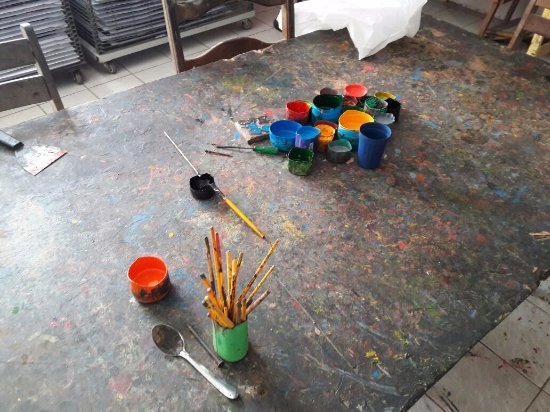
Identify the location of paintbrush holder. (236, 348).